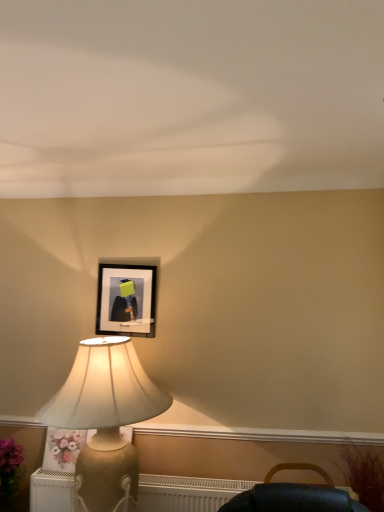
Question: From a real-world perspective, is floral fabric pillow at lower left on black matte picture frame at upper center?

Choices:
 (A) yes
 (B) no

Answer: (B)

Question: Does floral fabric pillow at lower left appear on the right side of black matte picture frame at upper center?

Choices:
 (A) yes
 (B) no

Answer: (B)

Question: Is the depth of floral fabric pillow at lower left greater than that of black matte picture frame at upper center?

Choices:
 (A) no
 (B) yes

Answer: (A)

Question: From the image's perspective, would you say floral fabric pillow at lower left is positioned over black matte picture frame at upper center?

Choices:
 (A) no
 (B) yes

Answer: (A)

Question: From the image's perspective, is floral fabric pillow at lower left below black matte picture frame at upper center?

Choices:
 (A) yes
 (B) no

Answer: (A)

Question: Considering the relative sizes of floral fabric pillow at lower left and black matte picture frame at upper center in the image provided, is floral fabric pillow at lower left smaller than black matte picture frame at upper center?

Choices:
 (A) yes
 (B) no

Answer: (A)

Question: Considering the relative positions of floral fabric pillow at lower left and gold textured lamp at left in the image provided, is floral fabric pillow at lower left behind gold textured lamp at left?

Choices:
 (A) yes
 (B) no

Answer: (A)

Question: From a real-world perspective, is floral fabric pillow at lower left on gold textured lamp at left?

Choices:
 (A) no
 (B) yes

Answer: (A)

Question: Can you confirm if floral fabric pillow at lower left is smaller than gold textured lamp at left?

Choices:
 (A) yes
 (B) no

Answer: (A)

Question: Can gold textured lamp at left be found inside floral fabric pillow at lower left?

Choices:
 (A) no
 (B) yes

Answer: (A)

Question: Is floral fabric pillow at lower left thinner than gold textured lamp at left?

Choices:
 (A) yes
 (B) no

Answer: (A)

Question: Is floral fabric pillow at lower left facing towards gold textured lamp at left?

Choices:
 (A) yes
 (B) no

Answer: (B)

Question: Is white textured radiator at lower left bigger than gold textured lamp at left?

Choices:
 (A) no
 (B) yes

Answer: (A)